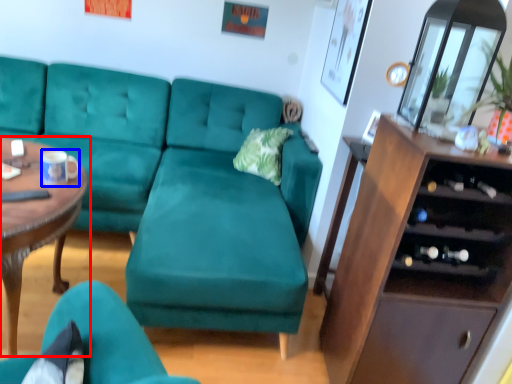
Question: Which of the following is the closest to the observer, coffee table (highlighted by a red box) or coffee cup (highlighted by a blue box)?

Choices:
 (A) coffee table
 (B) coffee cup

Answer: (A)